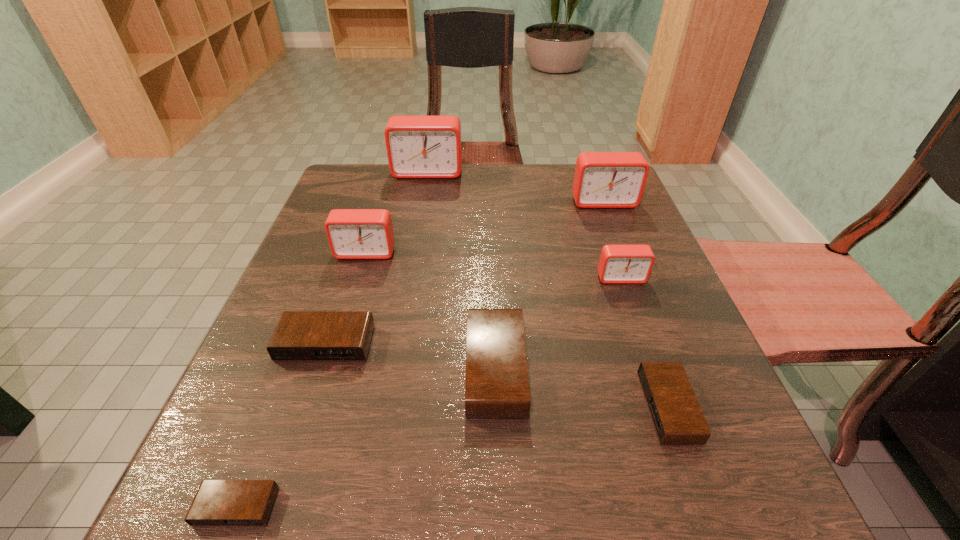
Find the location of a particular element. Image resolution: width=960 pixels, height=540 pixels. red alarm clock that stands as the closest to the sixth tallest alarm clock is located at coordinates (352, 233).

Select which red alarm clock appears as the second closest to the seventh shortest object. Please provide its 2D coordinates. Your answer should be formatted as a tuple, i.e. [(x, y)], where the tuple contains the x and y coordinates of a point satisfying the conditions above.

[(417, 146)]

In order to click on black alarm clock that is the second nearest to the second biggest black alarm clock in this screenshot , I will do `click(218, 503)`.

Identify which black alarm clock is the second closest to the seventh tallest alarm clock. Please provide its 2D coordinates. Your answer should be formatted as a tuple, i.e. [(x, y)], where the tuple contains the x and y coordinates of a point satisfying the conditions above.

[(300, 336)]